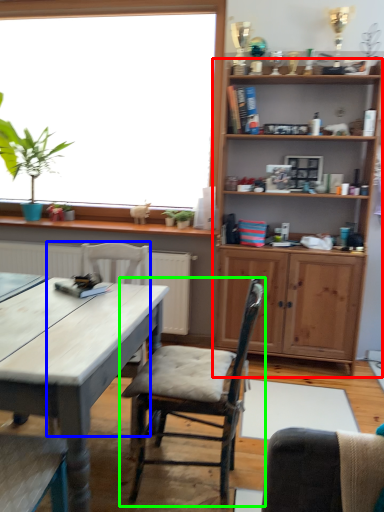
Question: Which is farther away from shelf (highlighted by a red box)? chair (highlighted by a blue box) or chair (highlighted by a green box)?

Choices:
 (A) chair
 (B) chair

Answer: (B)